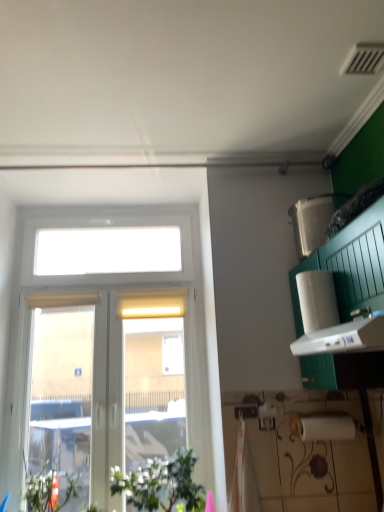
Question: From a real-world perspective, is white matte paper towel at right beneath green leafy plant at lower left?

Choices:
 (A) yes
 (B) no

Answer: (B)

Question: Considering the relative sizes of white matte paper towel at right and green leafy plant at lower left in the image provided, is white matte paper towel at right wider than green leafy plant at lower left?

Choices:
 (A) yes
 (B) no

Answer: (B)

Question: Does white matte paper towel at right have a lesser height compared to green leafy plant at lower left?

Choices:
 (A) yes
 (B) no

Answer: (A)

Question: Is white matte paper towel at right behind green leafy plant at lower left?

Choices:
 (A) yes
 (B) no

Answer: (B)

Question: Is green leafy plant at lower left at the back of white matte paper towel at right?

Choices:
 (A) yes
 (B) no

Answer: (B)

Question: Is green leafy plant at lower left in front of or behind white plastic window at left in the image?

Choices:
 (A) front
 (B) behind

Answer: (A)

Question: Is point (170, 500) positioned closer to the camera than point (92, 359)?

Choices:
 (A) closer
 (B) farther

Answer: (A)

Question: Would you say green leafy plant at lower left is to the left or to the right of white plastic window at left in the picture?

Choices:
 (A) right
 (B) left

Answer: (A)

Question: From the image's perspective, relative to white plastic window at left, is green leafy plant at lower left above or below?

Choices:
 (A) below
 (B) above

Answer: (A)

Question: From a real-world perspective, relative to green leafy plant at lower left, is white plastic window at left vertically above or below?

Choices:
 (A) below
 (B) above

Answer: (B)

Question: Considering their positions, is white plastic window at left located in front of or behind green leafy plant at lower left?

Choices:
 (A) front
 (B) behind

Answer: (B)

Question: Looking at the image, does white plastic window at left seem bigger or smaller compared to green leafy plant at lower left?

Choices:
 (A) big
 (B) small

Answer: (A)

Question: In terms of width, does white plastic window at left look wider or thinner when compared to green leafy plant at lower left?

Choices:
 (A) thin
 (B) wide

Answer: (A)

Question: Considering the positions of green leafy plant at lower left and white matte paper towel at right in the image, is green leafy plant at lower left wider or thinner than white matte paper towel at right?

Choices:
 (A) wide
 (B) thin

Answer: (A)

Question: Is green leafy plant at lower left inside or outside of white matte paper towel at right?

Choices:
 (A) outside
 (B) inside

Answer: (A)